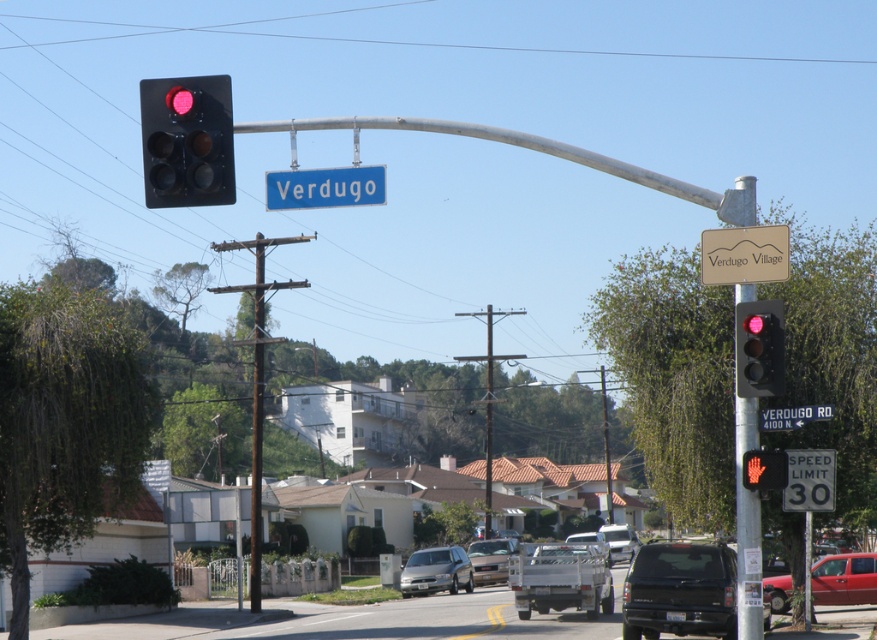
Which of these two, matte silver truck at center or matte black street light at center, stands shorter?

matte silver truck at center

Is matte silver truck at center bigger than matte black street light at center?

Incorrect, matte silver truck at center is not larger than matte black street light at center.

Is point (496, 548) more distant than point (487, 486)?

No, it is not.

This screenshot has height=640, width=877. Identify the location of matte silver truck at center. (490, 560).

Locate an element on the screen. matte silver truck at center is located at coordinates pyautogui.click(x=490, y=560).

At what (x,y) coordinates should I click in order to perform the action: click on matte silver truck at center. Please return your answer as a coordinate pair (x, y). Looking at the image, I should click on (490, 560).

Is clear blue sky at upper center above metallic pole at right?

Correct, clear blue sky at upper center is located above metallic pole at right.

Is the position of clear blue sky at upper center less distant than that of metallic pole at right?

No.

Does point (46, 44) lie behind point (744, 529)?

Yes, it is behind point (744, 529).

This screenshot has width=877, height=640. I want to click on clear blue sky at upper center, so click(376, 38).